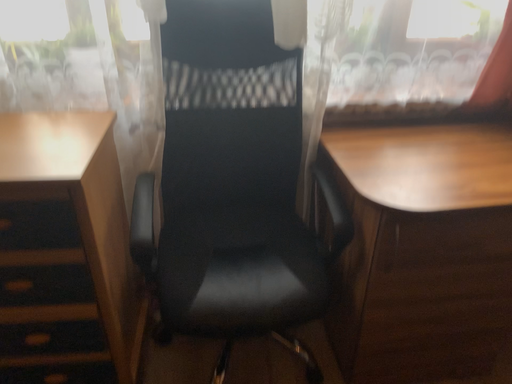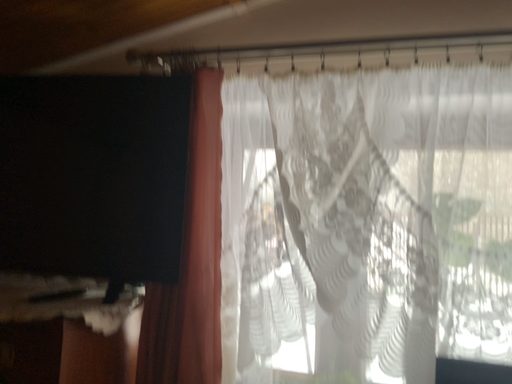
Question: How did the camera likely rotate when shooting the video?

Choices:
 (A) rotated downward
 (B) rotated upward

Answer: (B)